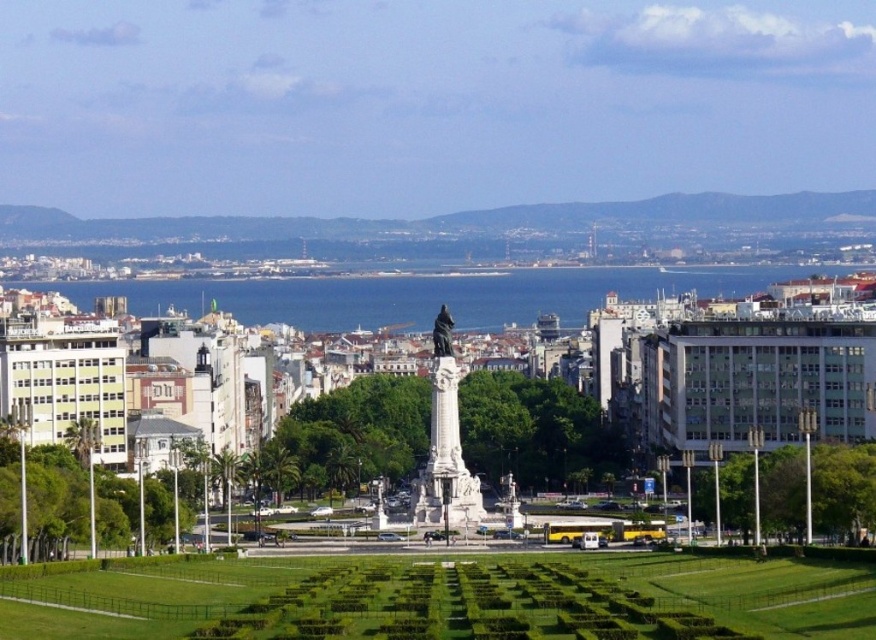
You are a tourist in Lisbon and want to take a photo of both the blue water at center and the white marble statue at center. Since the statue is smaller than the water feature, how should you position your camera to capture both subjects adequately?

The blue water at center is wider than the white marble statue at center. To capture both, position your camera so that the statue is centered and the water occupies the broader part of the frame, ensuring both are visible.

You are standing at the entrance of the park in the foreground. You want to find the white marble statue at center. According to the coordinates given, in which direction should you walk from your current position to reach it?

The white marble statue at center is located at coordinates point [444,444]. Since you are at the entrance of the park in the foreground, you should walk towards the center of the park to reach it.

You are a tourist standing in the park and want to take a photo of the white marble statue at center without the blue water at center in the frame. Is it possible to position yourself in such a way that the statue is visible but the water is not?

The white marble statue at center is behind blue water at center, so it is not possible to take a photo of the statue without the water appearing in the frame since the statue is positioned behind the water.